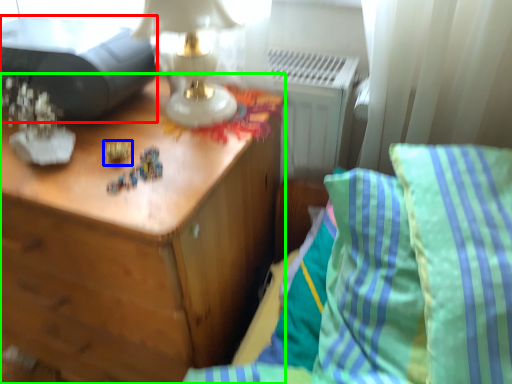
Question: Which object is the closest to the printer (highlighted by a red box)? Choose among these: toy (highlighted by a blue box) or nightstand (highlighted by a green box).

Choices:
 (A) toy
 (B) nightstand

Answer: (A)